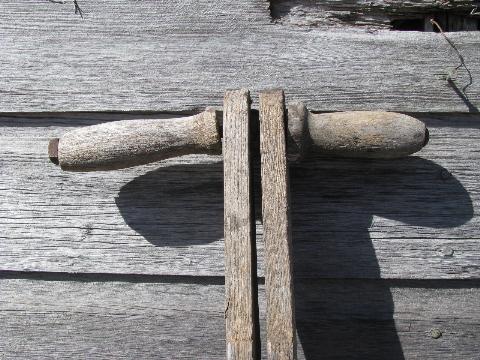
The height and width of the screenshot is (360, 480). I want to click on wood bar, so [x=238, y=312], [x=278, y=319].